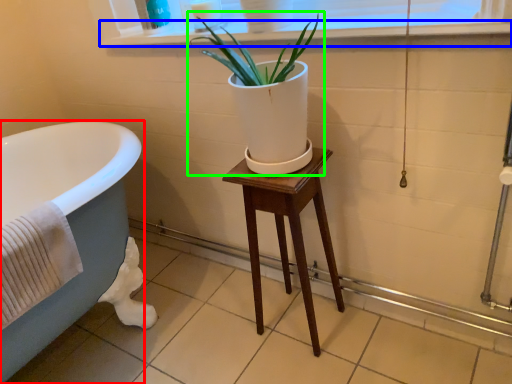
Question: Which object is positioned farthest from bathtub (highlighted by a red box)? Select from window sill (highlighted by a blue box) and houseplant (highlighted by a green box).

Choices:
 (A) window sill
 (B) houseplant

Answer: (A)